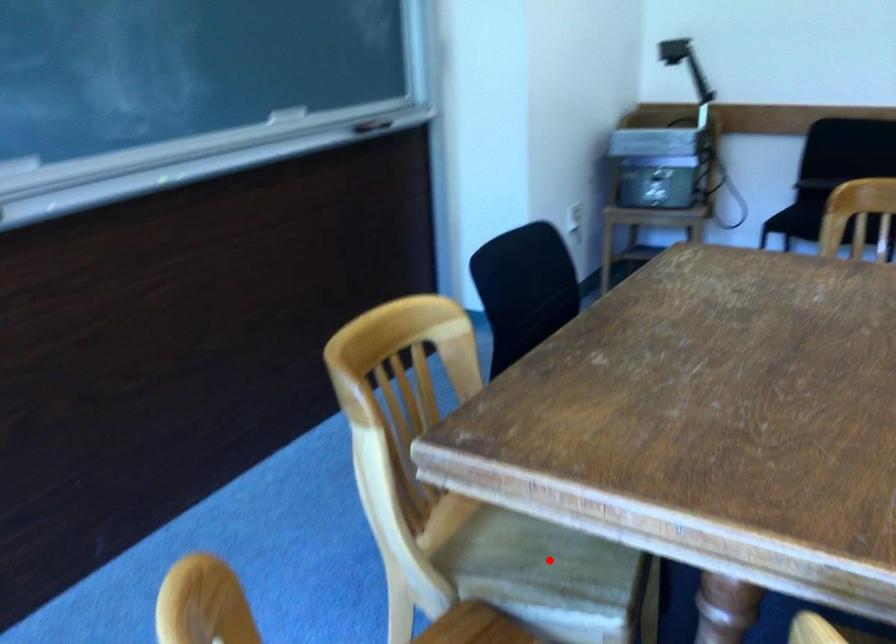
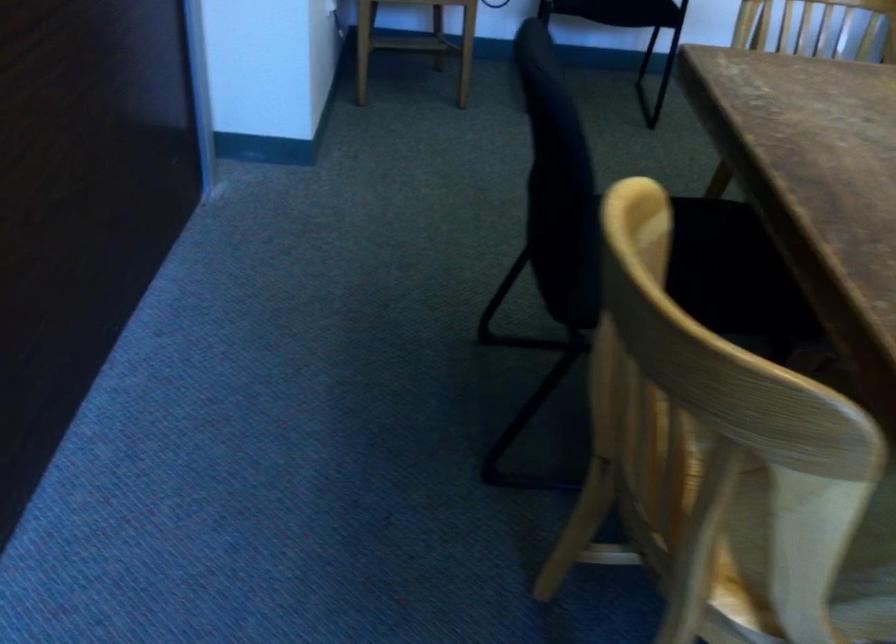
Question: I am providing you with two images of the same scene from different viewpoints. Image1 has a red point marked. In image2, the corresponding 3D location appears at what relative position? Reply with the corresponding letter.

Choices:
 (A) Closer
 (B) Farther

Answer: (A)